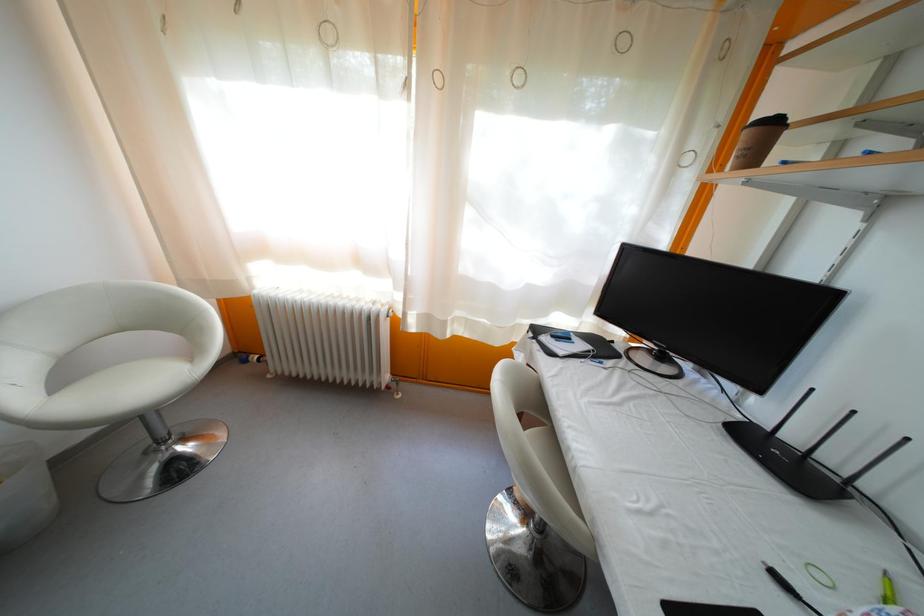
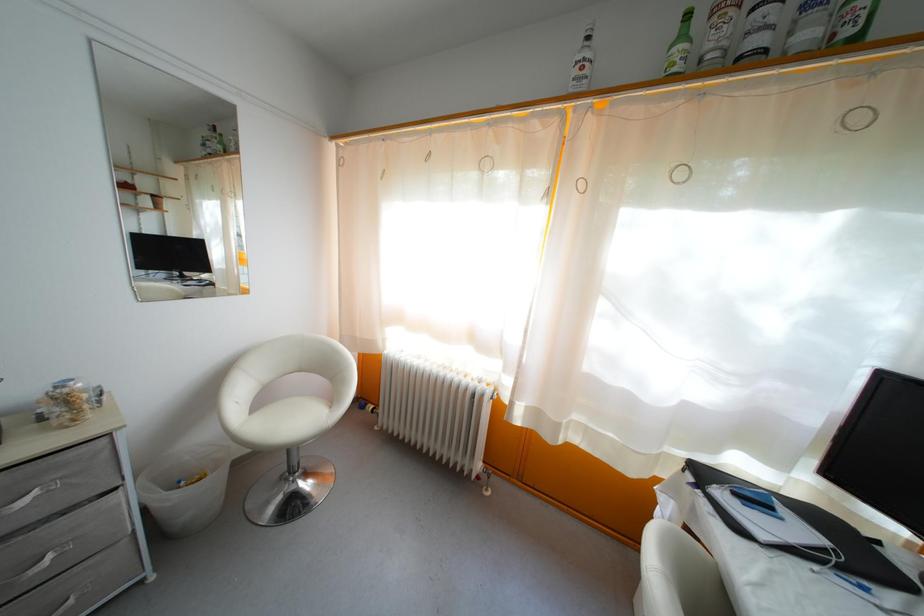
Question: The images are taken continuously from a first-person perspective. In which direction are you moving?

Choices:
 (A) Left
 (B) Right
 (C) Forward
 (D) Backward

Answer: (A)